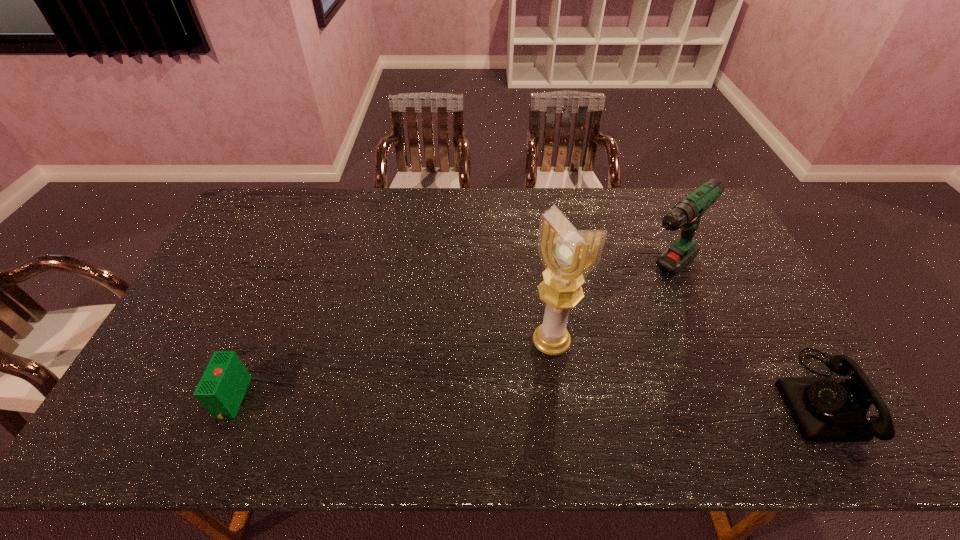
Where is `vacant area in the image that satisfies the following two spatial constraints: 1. on the back side of the third shortest object; 2. on the left side of the award`? vacant area in the image that satisfies the following two spatial constraints: 1. on the back side of the third shortest object; 2. on the left side of the award is located at coordinates (541, 273).